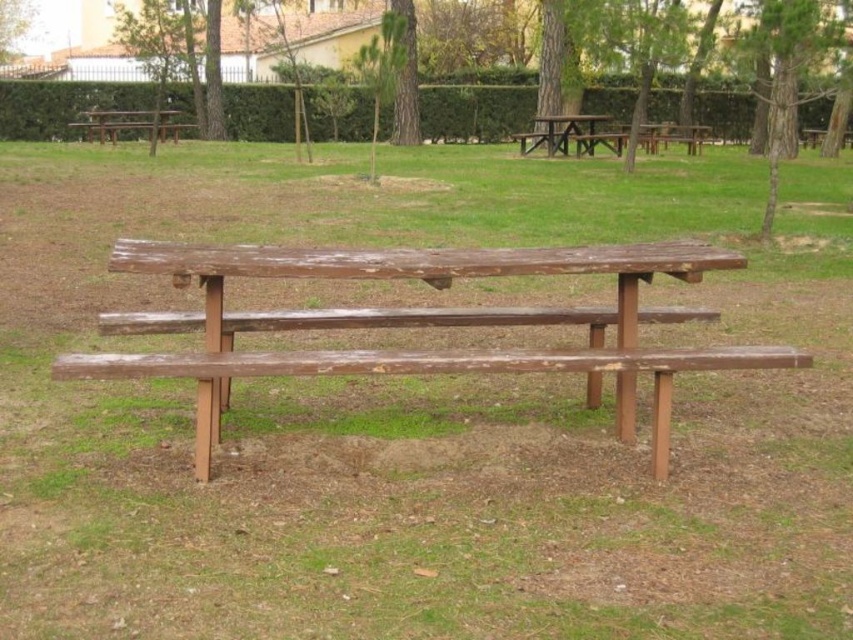
Does weathered wood bench at center appear under green rough bark tree at upper center?

Indeed, weathered wood bench at center is positioned under green rough bark tree at upper center.

Who is positioned more to the right, weathered wood bench at center or green rough bark tree at upper center?

green rough bark tree at upper center is more to the right.

Which is in front, point (683, 259) or point (807, 40)?

Point (683, 259) is more forward.

Locate an element on the screen. weathered wood bench at center is located at coordinates (418, 323).

Who is positioned more to the left, weathered wood bench at center or green matte tree at center?

green matte tree at center

Is point (137, 250) less distant than point (390, 13)?

Yes, point (137, 250) is closer to viewer.

This screenshot has height=640, width=853. I want to click on weathered wood bench at center, so click(x=418, y=323).

Which of these two, green textured tree at upper center or green leafy tree at upper center, stands shorter?

With less height is green leafy tree at upper center.

Does green textured tree at upper center have a lesser height compared to green leafy tree at upper center?

No, green textured tree at upper center is not shorter than green leafy tree at upper center.

Is point (141, 1) closer to viewer compared to point (1, 51)?

Yes, it is.

This screenshot has width=853, height=640. In order to click on green textured tree at upper center in this screenshot , I will do `click(161, 51)`.